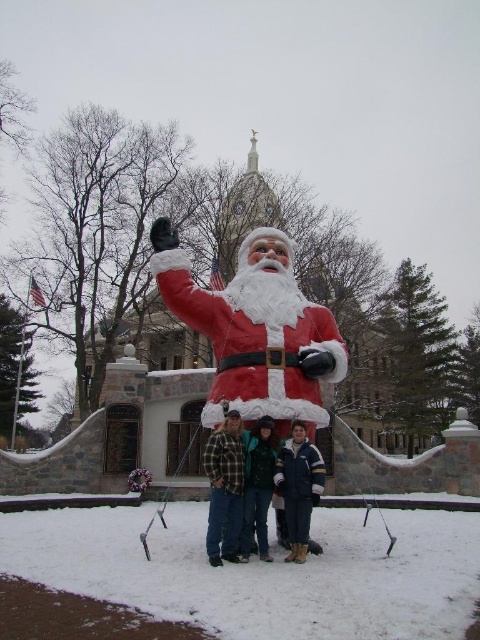
Question: Is white fluffy snow at lower center wider than flannel shirt at center?

Choices:
 (A) no
 (B) yes

Answer: (B)

Question: Is white fluffy snow at lower center above matte red santa at center?

Choices:
 (A) no
 (B) yes

Answer: (A)

Question: Can you confirm if matte red santa at center is smaller than flannel shirt at center?

Choices:
 (A) yes
 (B) no

Answer: (B)

Question: Which object is farther from the camera taking this photo?

Choices:
 (A) matte plastic santa at center
 (B) matte red santa at center
 (C) white fluffy snow at lower center

Answer: (A)

Question: Based on their relative distances, which object is farther from the white fluffy snow at lower center?

Choices:
 (A) flannel shirt at center
 (B) matte plastic santa at center

Answer: (B)

Question: Which of the following is the closest to the observer?

Choices:
 (A) white fluffy snow at lower center
 (B) matte red santa at center

Answer: (A)